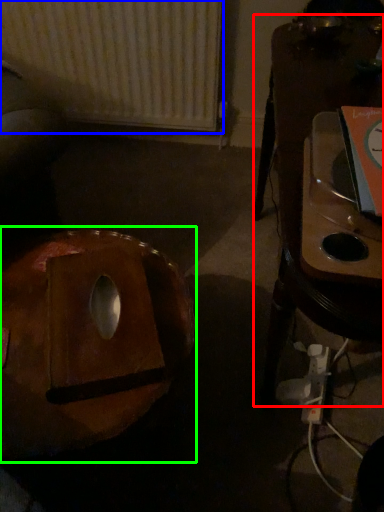
Question: Based on their relative distances, which object is nearer to furniture (highlighted by a red box)? Choose from radiator (highlighted by a blue box) and bean bag chair (highlighted by a green box).

Choices:
 (A) radiator
 (B) bean bag chair

Answer: (B)